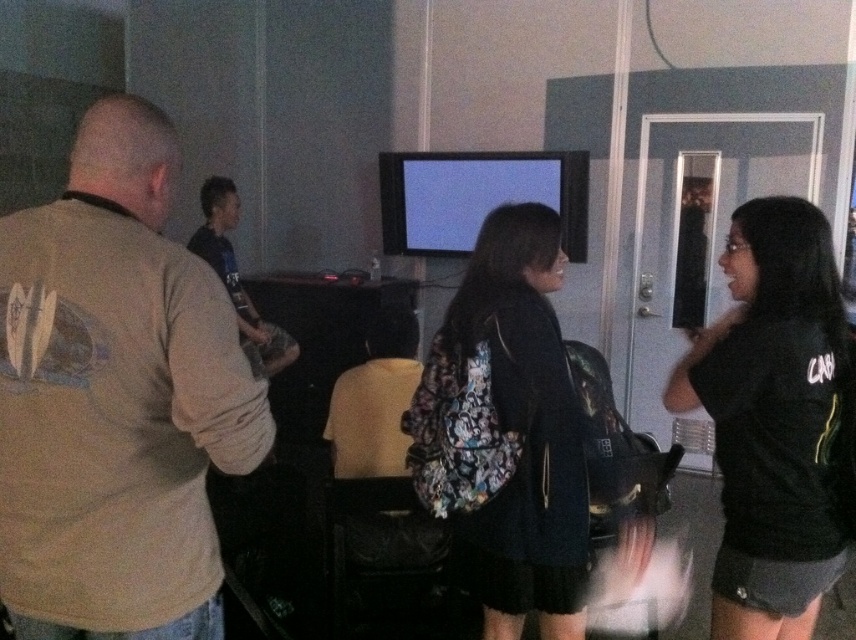
Question: Is beige cotton shirt at left to the left of black matte shirt at right from the viewer's perspective?

Choices:
 (A) yes
 (B) no

Answer: (A)

Question: Can you confirm if black matte shirt at right is smaller than matte black shirt at center?

Choices:
 (A) no
 (B) yes

Answer: (B)

Question: Which of the following is the farthest from the observer?

Choices:
 (A) floral-patterned backpack at center
 (B) beige cotton shirt at left

Answer: (A)

Question: Is beige cotton shirt at left closer to camera compared to matte black shirt at center?

Choices:
 (A) yes
 (B) no

Answer: (A)

Question: Which object appears closest to the camera in this image?

Choices:
 (A) black matte shirt at right
 (B) floral-patterned backpack at center

Answer: (A)

Question: Considering the real-world distances, which object is farthest from the beige cotton shirt at left?

Choices:
 (A) floral-patterned backpack at center
 (B) black matte shirt at right

Answer: (B)